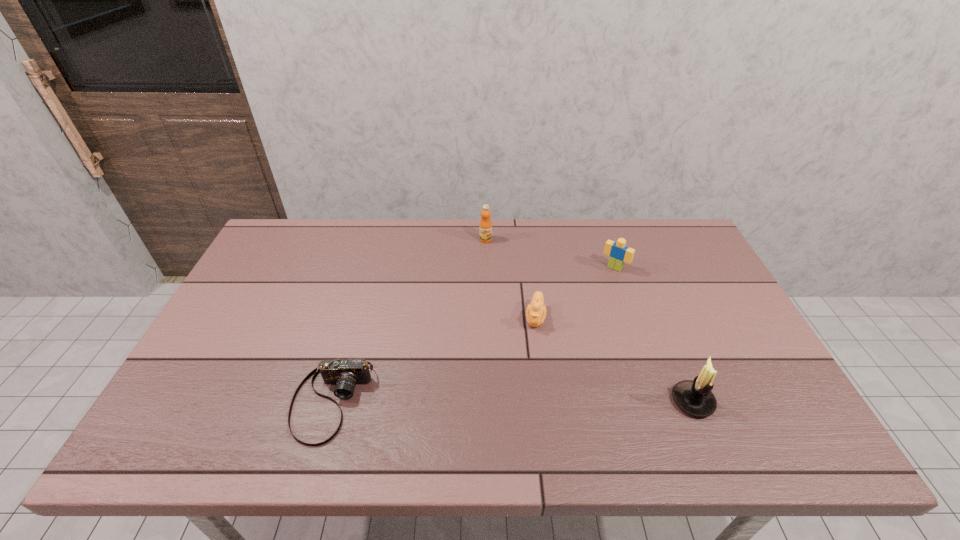
Locate an element on the screen. The image size is (960, 540). vacant area situated 0.350m on the front label of the orange juice is located at coordinates (478, 319).

You are a GUI agent. You are given a task and a screenshot of the screen. Output one action in this format:
    pyautogui.click(x=<x>, y=<y>)
    Task: Click on the free space located 0.100m on the front label of the orange juice
    
    Given the screenshot: What is the action you would take?
    pyautogui.click(x=484, y=262)

This screenshot has height=540, width=960. In order to click on vacant space located 0.390m on the front label of the orange juice in this screenshot , I will do `click(477, 330)`.

Where is `free location located 0.080m on the face of the third farthest object`? The width and height of the screenshot is (960, 540). free location located 0.080m on the face of the third farthest object is located at coordinates (531, 355).

Identify the location of vacant space located on the face of the third farthest object. coord(524,397).

Where is `vacant area situated 0.210m on the face of the third farthest object`? vacant area situated 0.210m on the face of the third farthest object is located at coordinates tap(524, 397).

You are a GUI agent. You are given a task and a screenshot of the screen. Output one action in this format:
    pyautogui.click(x=<x>, y=<y>)
    Task: Click on the vacant space situated on the face of the fourth nearest object
    This screenshot has width=960, height=540.
    Given the screenshot: What is the action you would take?
    pyautogui.click(x=596, y=289)

I want to click on vacant region located on the face of the fourth nearest object, so click(576, 315).

Image resolution: width=960 pixels, height=540 pixels. I want to click on free space located on the face of the fourth nearest object, so click(550, 349).

I want to click on orange juice at the far edge, so click(x=485, y=227).